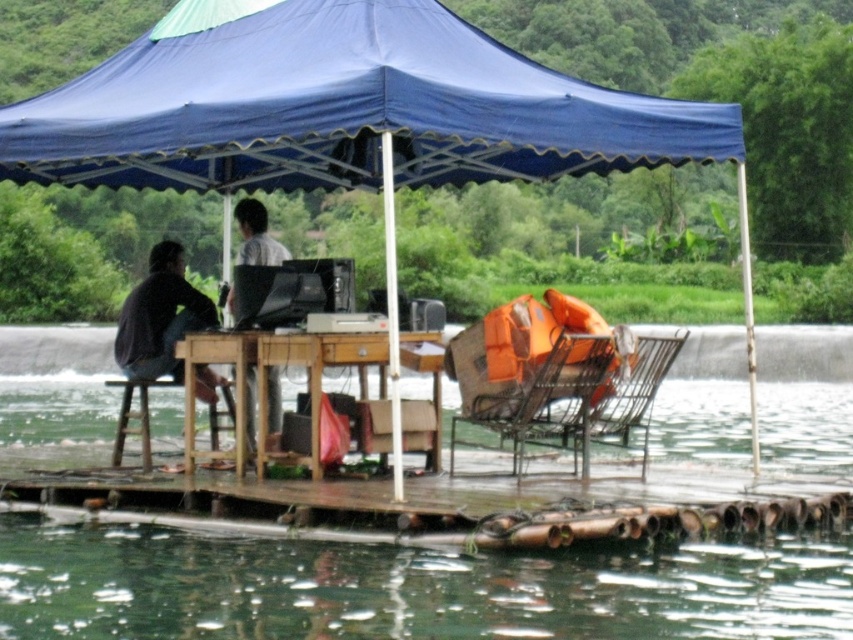
The width and height of the screenshot is (853, 640). Describe the element at coordinates (343, 109) in the screenshot. I see `blue fabric canopy at upper center` at that location.

Where is `blue fabric canopy at upper center`? The height and width of the screenshot is (640, 853). blue fabric canopy at upper center is located at coordinates (343, 109).

Between point (572, 355) and point (259, 236), which one is positioned behind?

The point (259, 236) is more distant.

Does point (587, 392) lie in front of point (247, 204)?

Yes, point (587, 392) is closer to viewer.

The height and width of the screenshot is (640, 853). I want to click on orange fabric chair at center, so click(532, 396).

Which is above, dark gray shirt at left or matte plastic chair at center?

dark gray shirt at left is above.

Who is positioned more to the left, dark gray shirt at left or matte plastic chair at center?

Positioned to the left is dark gray shirt at left.

The height and width of the screenshot is (640, 853). What do you see at coordinates (160, 316) in the screenshot?
I see `dark gray shirt at left` at bounding box center [160, 316].

Where is `dark gray shirt at left`? This screenshot has width=853, height=640. dark gray shirt at left is located at coordinates (160, 316).